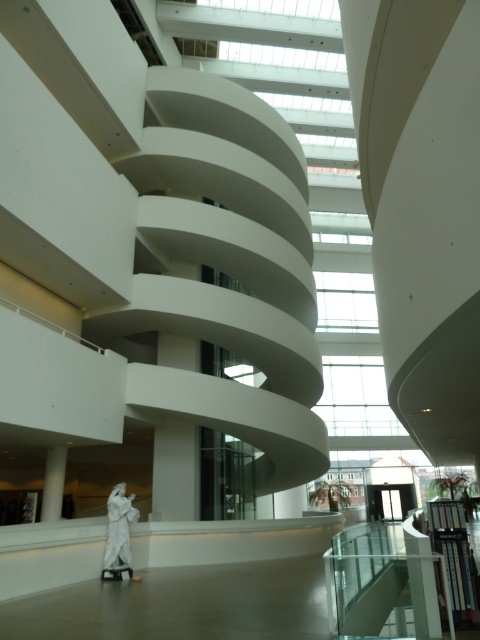
You are an art curator planning to move a new sculpture into the gallery. The sculpture requires a clear space of 2 meters in diameter. Can the white marble statue at center be moved to the area where the white glossy stair at lower center is currently located without obstructing the stair?

The white glossy stair at lower center is positioned over the white marble statue at center, meaning the statue cannot be moved to the stair area as it would interfere with the stair structure.

Consider the image. You are an architect visiting the museum and want to place a new sculpture exactly halfway between the white glossy stair at lower center and the white marble statue at center. Which object will the sculpture be closer to?

The sculpture will be closer to the white glossy stair at lower center because it has a lesser height compared to the white marble statue at center, so the halfway point would be nearer to the shorter object.